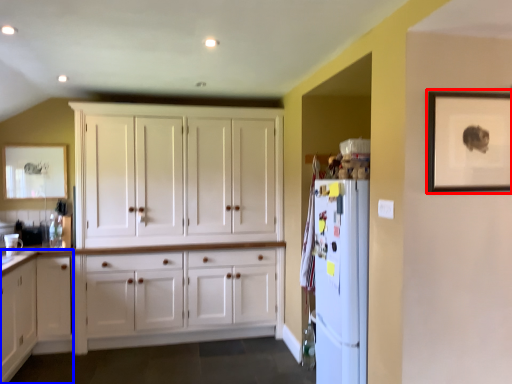
Question: Which object is closer to the camera taking this photo, picture frame (highlighted by a red box) or dresser (highlighted by a blue box)?

Choices:
 (A) picture frame
 (B) dresser

Answer: (A)